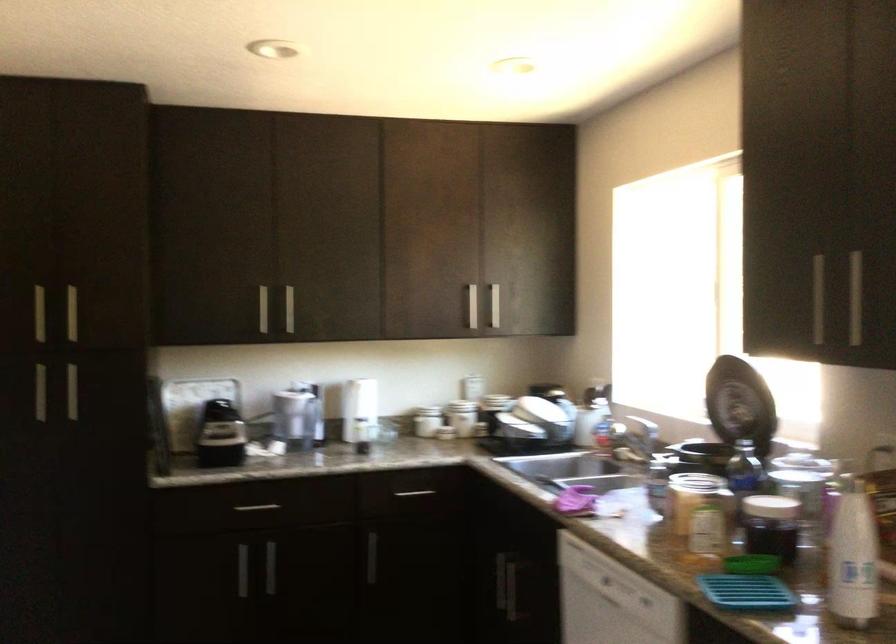
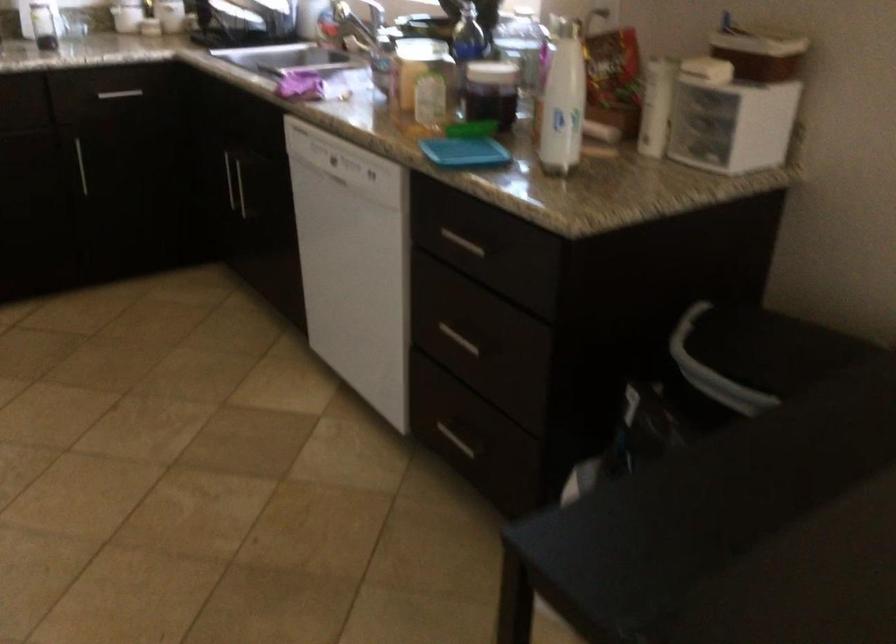
The point at (373, 560) is marked in the first image. Where is the corresponding point in the second image?

(81, 166)